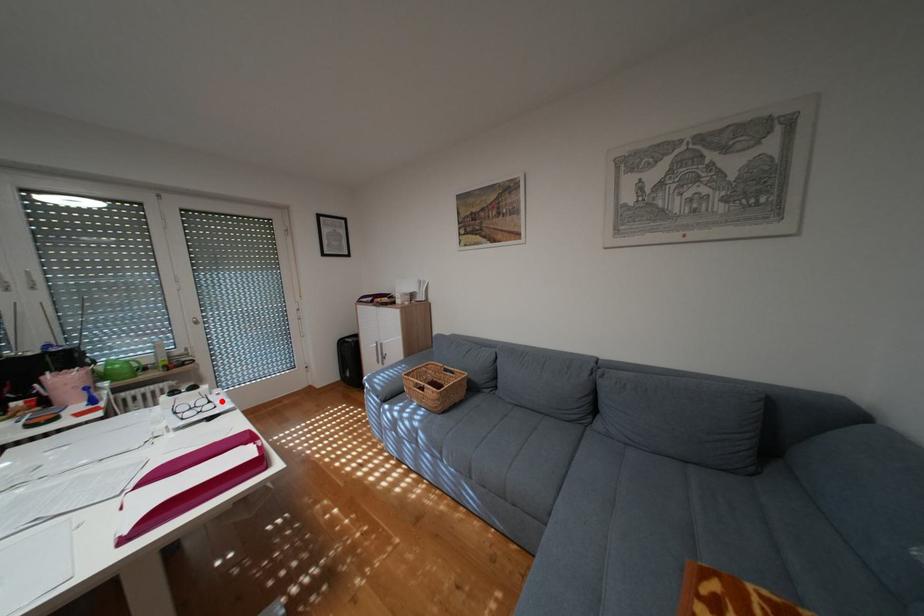
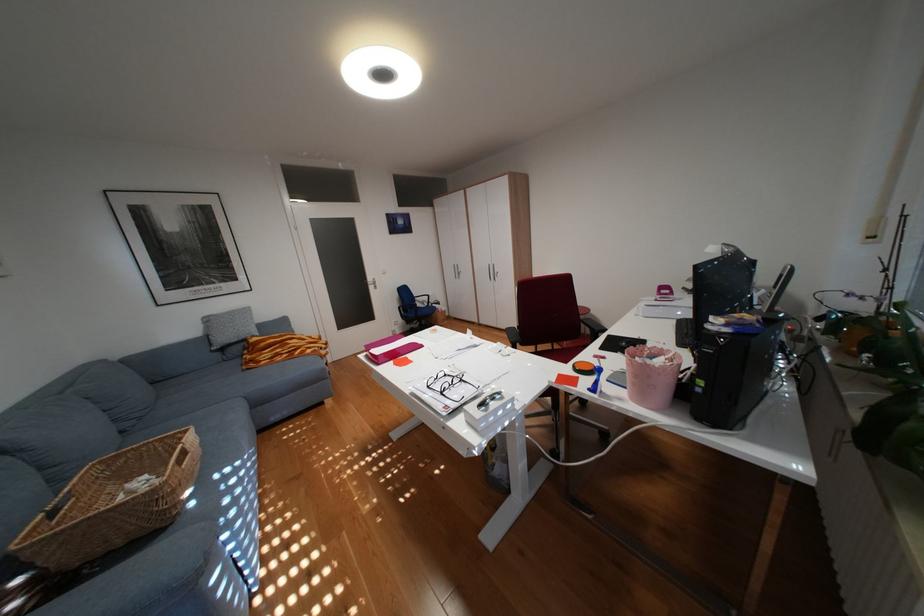
Question: I am providing you with two images of the same scene from different viewpoints. In image1, a red point is highlighted. Considering the same 3D point in image2, which of the following is correct?

Choices:
 (A) It is closer
 (B) It is farther

Answer: (B)